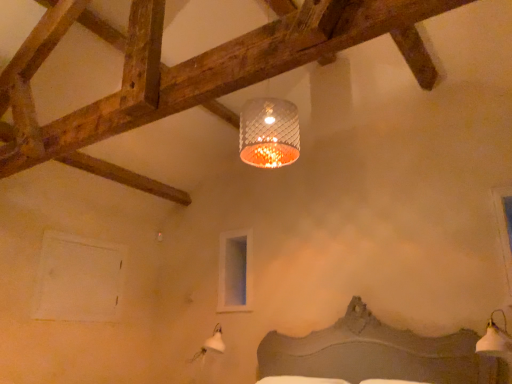
Question: Does point (50, 231) appear closer or farther from the camera than point (240, 286)?

Choices:
 (A) farther
 (B) closer

Answer: (B)

Question: In terms of width, does white matte window at lower left, marked as the 2th window in a back-to-front arrangement, look wider or thinner when compared to clear glass window at upper center, the third window when ordered from front to back?

Choices:
 (A) thin
 (B) wide

Answer: (B)

Question: Estimate the real-world distances between objects in this image. Which object is closer to the clear glass window at upper center, marked as the second window in a left-to-right arrangement?

Choices:
 (A) white matte window at lower left, which is counted as the third window, starting from the right
 (B) transparent glass window at upper right, the 3th window from the left
 (C) white glossy lampshade at lower right

Answer: (A)

Question: Which object is positioned farthest from the clear glass window at upper center, which is the 2th window in right-to-left order?

Choices:
 (A) white glossy lampshade at lower right
 (B) white matte window at lower left, placed as the 1th window when sorted from left to right
 (C) transparent glass window at upper right, positioned as the 1th window in front-to-back order

Answer: (C)